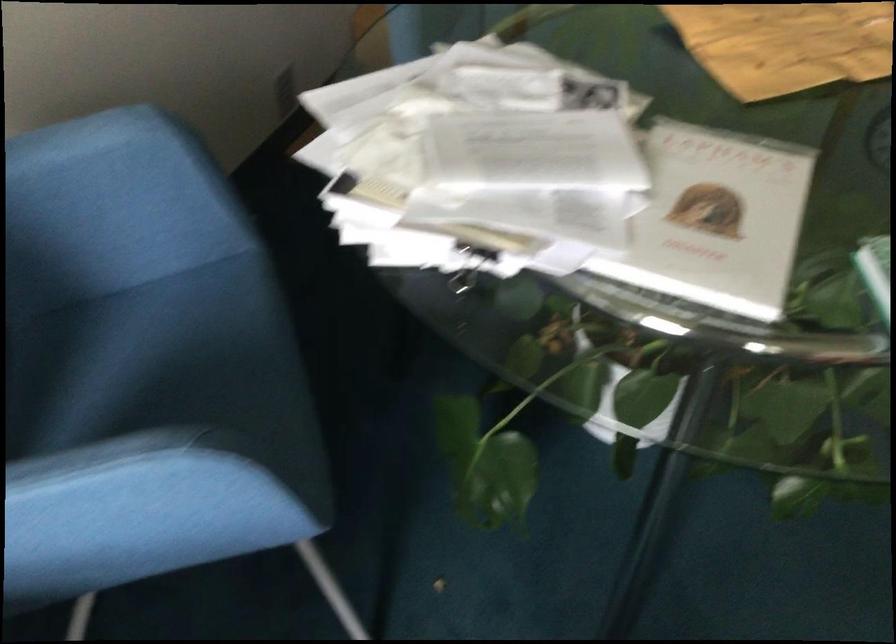
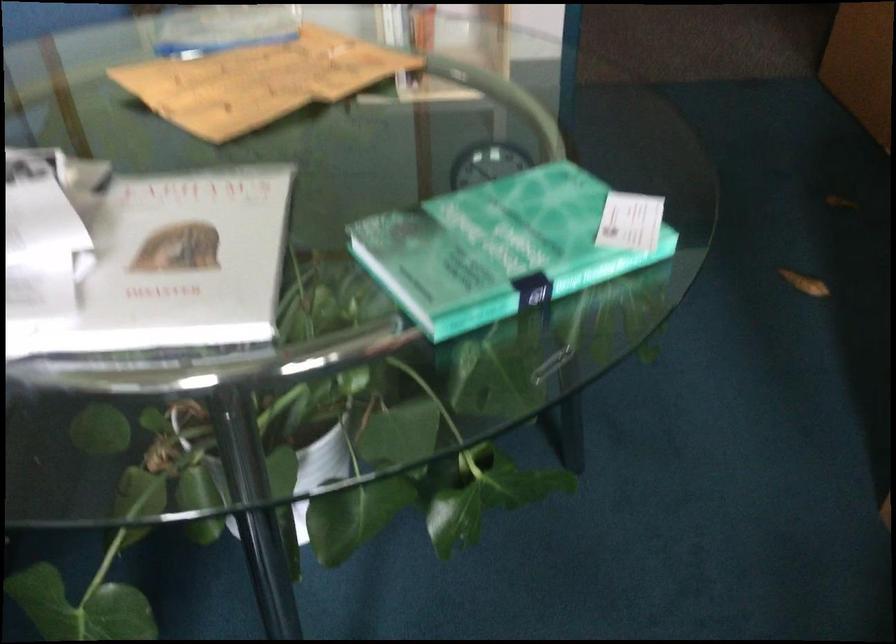
The point at (727, 231) is marked in the first image. Where is the corresponding point in the second image?

(186, 259)